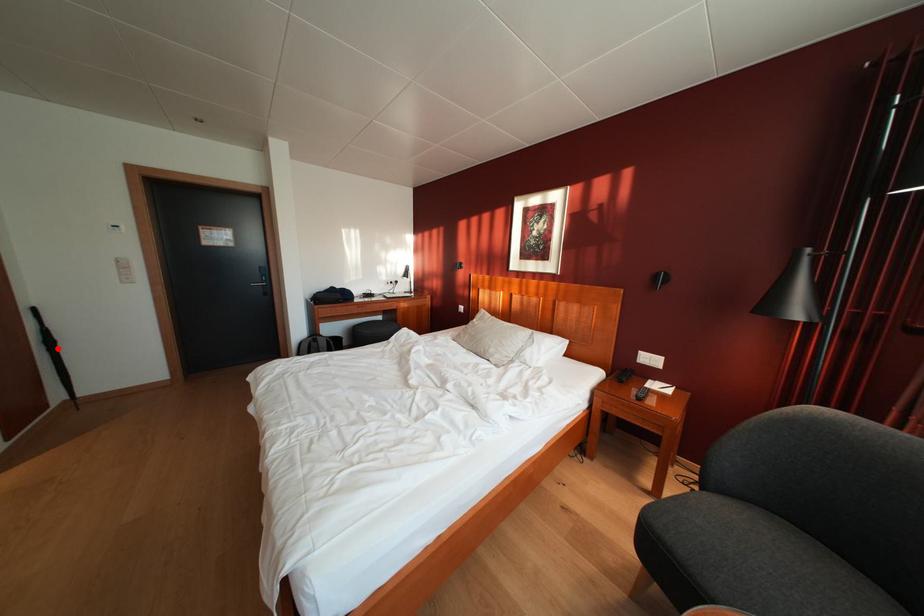
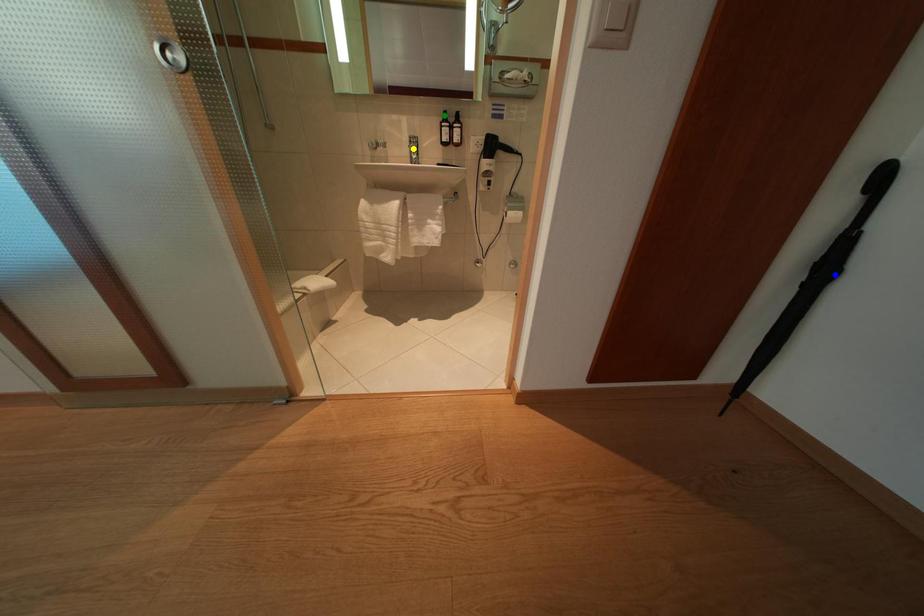
Question: I am providing you with two images of the same scene from different viewpoints. A red point is marked on the first image. You are given multiple points on the second image. In image 2, which mark is for the same physical point as the one in image 1?

Choices:
 (A) yellow point
 (B) blue point
 (C) green point

Answer: (B)